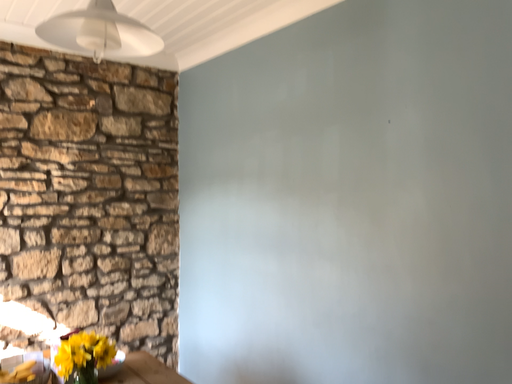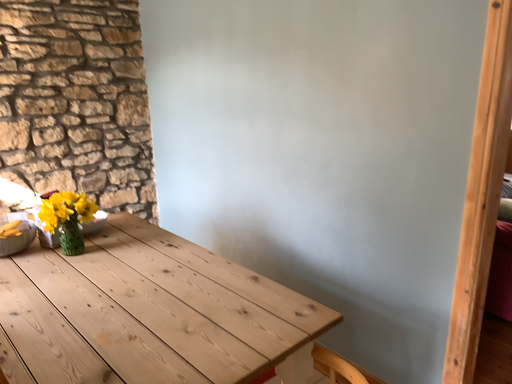
Question: Which way did the camera rotate in the video?

Choices:
 (A) rotated upward
 (B) rotated downward

Answer: (B)